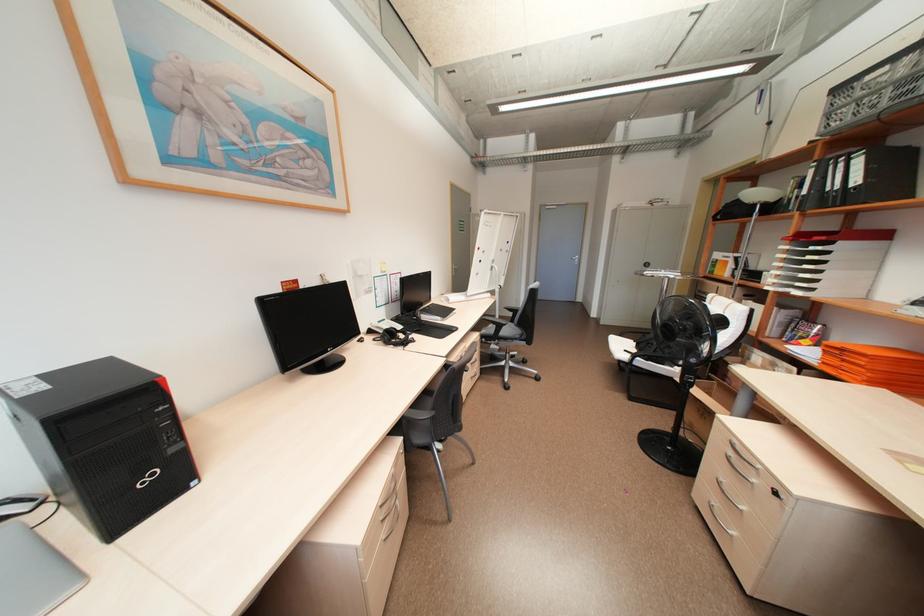
This screenshot has height=616, width=924. Describe the element at coordinates (380, 325) in the screenshot. I see `the telephone handset` at that location.